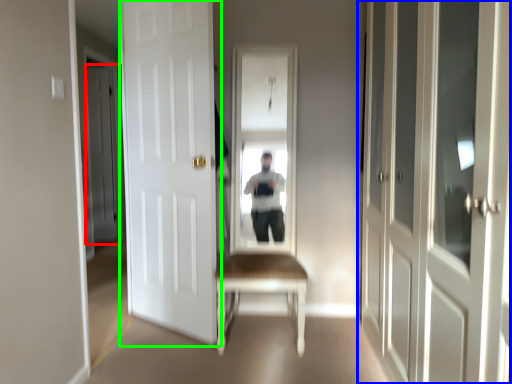
Question: Which object is the farthest from door (highlighted by a red box)? Choose among these: door (highlighted by a blue box) or door (highlighted by a green box).

Choices:
 (A) door
 (B) door

Answer: (A)